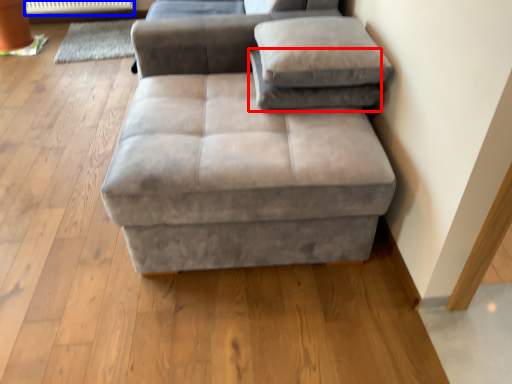
Question: Which point is closer to the camera, pillow (highlighted by a red box) or radiator (highlighted by a blue box)?

Choices:
 (A) pillow
 (B) radiator

Answer: (A)